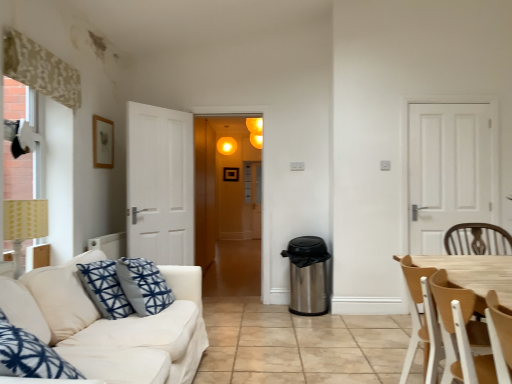
Locate an element on the screen. free spot above white matte door at right (from a real-world perspective) is located at coordinates (450, 104).